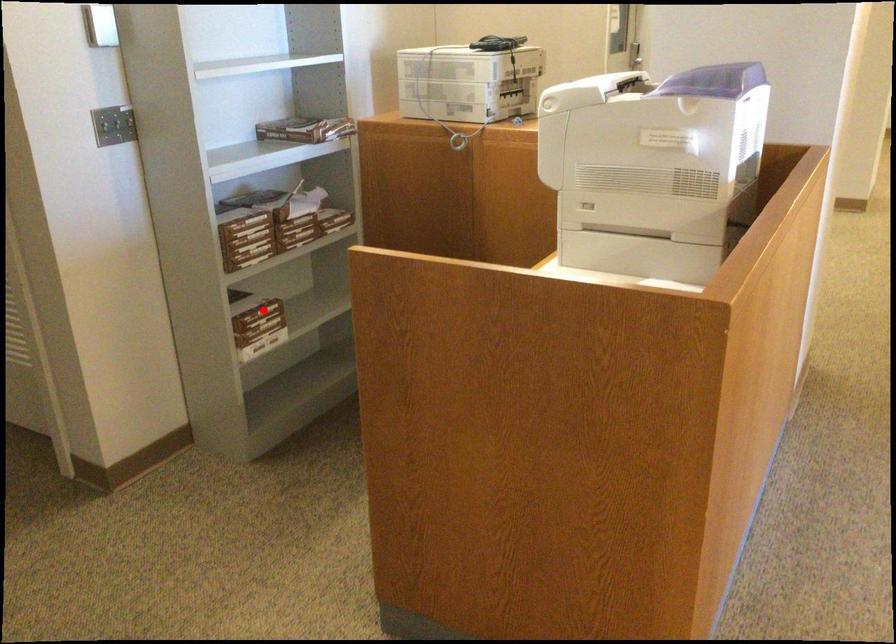
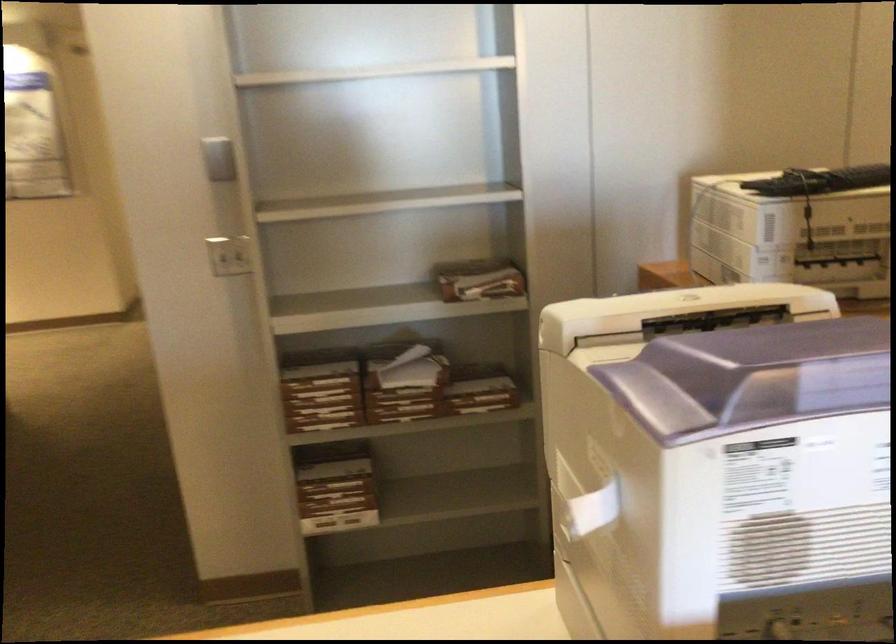
Find the pixel in the second image that matches the highlighted location in the first image.

(334, 488)